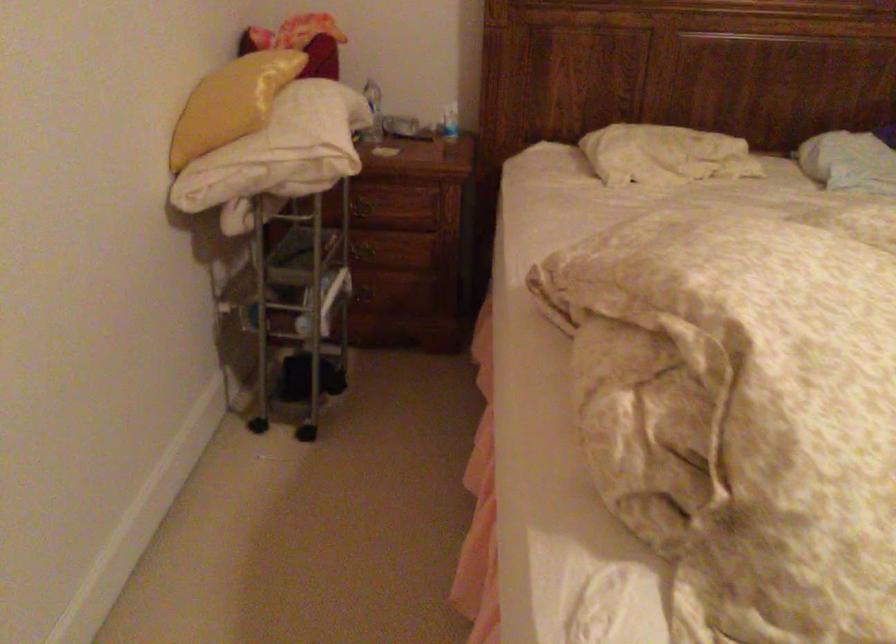
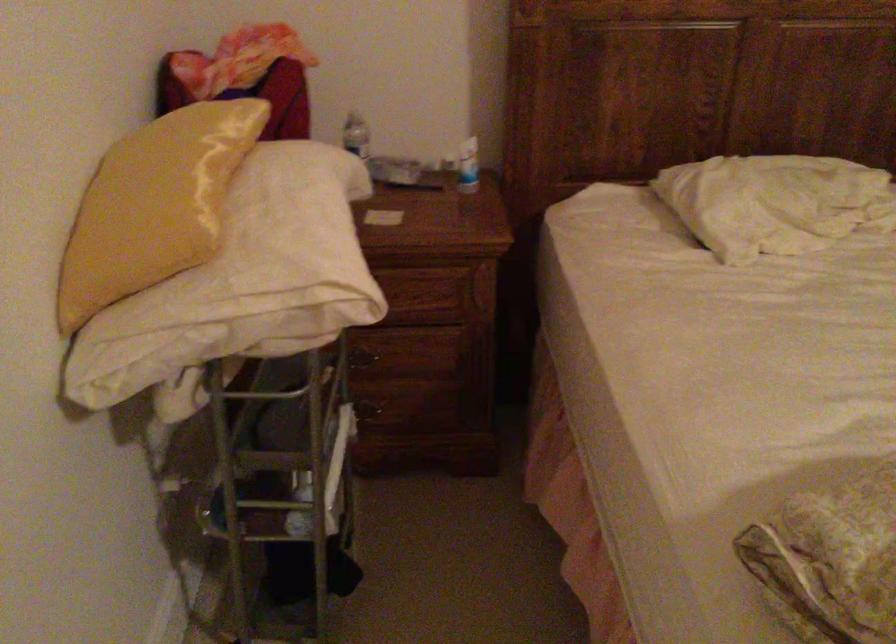
In the second image, find the point that corresponds to the point at 453,122 in the first image.

(468, 166)